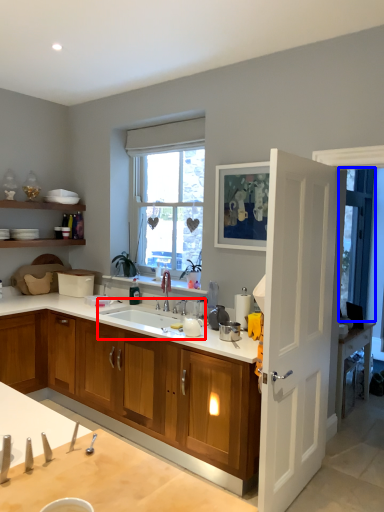
Question: Which point is further to the camera, sink (highlighted by a red box) or window screen (highlighted by a blue box)?

Choices:
 (A) sink
 (B) window screen

Answer: (B)